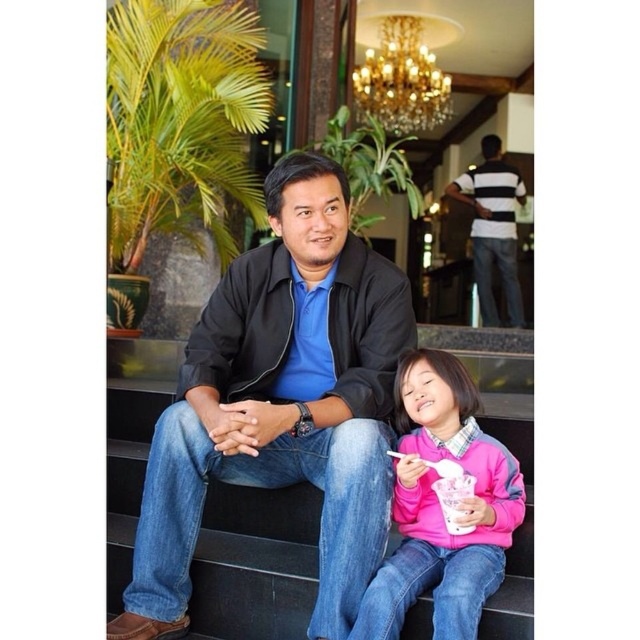
You are standing in the indoor tropical space shown. You want to take a photo of the smooth black stairs at center and the gold metallic chandelier at upper center in the same frame. Which object should be placed closer to the camera to ensure both are visible?

The smooth black stairs at center is located below the gold metallic chandelier at upper center. To capture both in the same frame, position the stairs closer to the camera so the chandelier remains in view above them.

From the picture: You are designing a new set of stairs for a modern home. The current design includes the smooth black stairs at center and the pink fleece sweater at lower right. Which object is narrower in width?

The smooth black stairs at center is thinner than the pink fleece sweater at lower right, so the smooth black stairs at center is narrower in width.

You are standing in the tropical indoor space and want to place a decorative plant pot on the smooth black stairs at center. However, there is a pink fleece sweater at lower right nearby. Where should you place the plant pot to avoid the sweater?

The smooth black stairs at center is positioned under the pink fleece sweater at lower right, so placing the plant pot on the stairs would be below the sweater. To avoid the sweater, place the plant pot on the stairs away from the lower right area where the sweater is located.